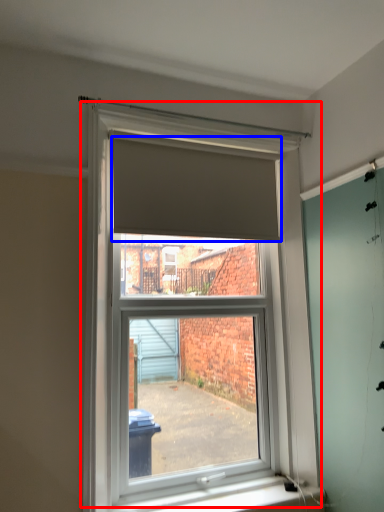
Question: Which point is closer to the camera, window (highlighted by a red box) or blind (highlighted by a blue box)?

Choices:
 (A) window
 (B) blind

Answer: (A)